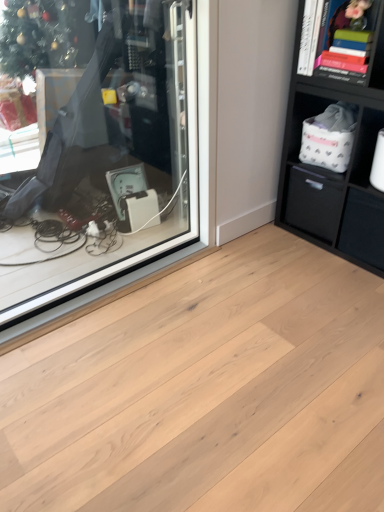
Measure the distance between hardcover book at upper right, placed as the second cabinet when sorted from right to left, and camera.

hardcover book at upper right, placed as the second cabinet when sorted from right to left, and camera are 1.70 meters apart.

What do you see at coordinates (313, 200) in the screenshot? Image resolution: width=384 pixels, height=512 pixels. I see `black fabric drawer at lower right, the 1th drawer when ordered from left to right` at bounding box center [313, 200].

This screenshot has height=512, width=384. What are the coordinates of `white fabric basket at right, which is the second cabinet from top to bottom` in the screenshot? It's located at (365, 147).

Measure the distance between point (364, 151) and camera.

Point (364, 151) and camera are 6.42 feet apart.

This screenshot has width=384, height=512. Describe the element at coordinates (207, 391) in the screenshot. I see `natural wood plank at center` at that location.

Locate an element on the screen. The image size is (384, 512). matte black drawer at lower right, the 2th drawer when ordered from left to right is located at coordinates (363, 228).

Where is `hardcover book at upper right, placed as the second cabinet when sorted from right to left`? hardcover book at upper right, placed as the second cabinet when sorted from right to left is located at coordinates (342, 42).

Which point is more forward, (373, 133) or (85, 392)?

The point (85, 392) is in front.

From the image's perspective, relative to natural wood plank at center, is white fabric basket at right, the second cabinet from the left, above or below?

From the image's perspective, white fabric basket at right, the second cabinet from the left, appears above natural wood plank at center.

Considering the relative positions of white fabric basket at right, which is counted as the first cabinet, starting from the right, and natural wood plank at center in the image provided, is white fabric basket at right, which is counted as the first cabinet, starting from the right, behind natural wood plank at center?

Yes, white fabric basket at right, which is counted as the first cabinet, starting from the right, is further from the viewer.

Is white fabric basket at right, which is the second cabinet from top to bottom, facing towards natural wood plank at center?

Yes.

Is point (337, 453) farther from camera compared to point (356, 220)?

No, (337, 453) is in front of (356, 220).

From the image's perspective, is natural wood plank at center positioned above or below matte black drawer at lower right, the 2th drawer when ordered from left to right?

Clearly, from the image's perspective, natural wood plank at center is below matte black drawer at lower right, the 2th drawer when ordered from left to right.

Considering the sizes of objects natural wood plank at center and matte black drawer at lower right, the 1th drawer from the right, in the image provided, who is wider, natural wood plank at center or matte black drawer at lower right, the 1th drawer from the right,?

Wider between the two is natural wood plank at center.

Locate an element on the screen. the 1st drawer above the natural wood plank at center (from the image's perspective) is located at coordinates (363, 228).

Could matte black drawer at lower right, the 1th drawer from the right, be considered to be inside black fabric drawer at lower right, which is counted as the second drawer, starting from the right?

Definitely not — matte black drawer at lower right, the 1th drawer from the right, is not inside black fabric drawer at lower right, which is counted as the second drawer, starting from the right.

In terms of size, does black fabric drawer at lower right, the 1th drawer when ordered from left to right, appear bigger or smaller than matte black drawer at lower right, the 2th drawer when ordered from left to right?

black fabric drawer at lower right, the 1th drawer when ordered from left to right, is bigger than matte black drawer at lower right, the 2th drawer when ordered from left to right.

From the image's perspective, is black fabric drawer at lower right, which is counted as the second drawer, starting from the right, located beneath matte black drawer at lower right, the 2th drawer when ordered from left to right?

No, from the image's perspective, black fabric drawer at lower right, which is counted as the second drawer, starting from the right, is not below matte black drawer at lower right, the 2th drawer when ordered from left to right.

From a real-world perspective, is black fabric drawer at lower right, which is counted as the second drawer, starting from the right, physically located above or below matte black drawer at lower right, the 2th drawer when ordered from left to right?

black fabric drawer at lower right, which is counted as the second drawer, starting from the right, is situated higher than matte black drawer at lower right, the 2th drawer when ordered from left to right, in the real world.

Are white fabric basket at right, the second cabinet from the left, and transparent glass shop window at upper left located far from each other?

white fabric basket at right, the second cabinet from the left, is positioned a significant distance from transparent glass shop window at upper left.

From a real-world perspective, is white fabric basket at right, which is the second cabinet from top to bottom, under transparent glass shop window at upper left?

Yes, from a real-world perspective, white fabric basket at right, which is the second cabinet from top to bottom, is beneath transparent glass shop window at upper left.

Which object is further away from the camera, white fabric basket at right, which is the second cabinet from top to bottom, or transparent glass shop window at upper left?

Positioned behind is white fabric basket at right, which is the second cabinet from top to bottom.

Looking at this image, is white fabric basket at right, which is counted as the first cabinet, starting from the right, bigger or smaller than transparent glass shop window at upper left?

Considering their sizes, white fabric basket at right, which is counted as the first cabinet, starting from the right, takes up less space than transparent glass shop window at upper left.

Can you confirm if black fabric drawer at lower right, the 1th drawer when ordered from left to right, is wider than transparent glass shop window at upper left?

Indeed, black fabric drawer at lower right, the 1th drawer when ordered from left to right, has a greater width compared to transparent glass shop window at upper left.

Do you think black fabric drawer at lower right, which is counted as the second drawer, starting from the right, is within transparent glass shop window at upper left, or outside of it?

black fabric drawer at lower right, which is counted as the second drawer, starting from the right, is outside transparent glass shop window at upper left.

Does black fabric drawer at lower right, the 1th drawer when ordered from left to right, turn towards transparent glass shop window at upper left?

Yes, black fabric drawer at lower right, the 1th drawer when ordered from left to right, is aimed at transparent glass shop window at upper left.

Who is bigger, white fabric basket at right, the second cabinet from the left, or black fabric drawer at lower right, the 1th drawer when ordered from left to right?

black fabric drawer at lower right, the 1th drawer when ordered from left to right, is bigger.

From the image's perspective, is white fabric basket at right, which appears as the 1th cabinet when ordered from the bottom, under black fabric drawer at lower right, the 1th drawer when ordered from left to right?

No, from the image's perspective, white fabric basket at right, which appears as the 1th cabinet when ordered from the bottom, is not beneath black fabric drawer at lower right, the 1th drawer when ordered from left to right.

Considering the positions of points (366, 159) and (329, 181), is point (366, 159) closer to camera compared to point (329, 181)?

Yes, it is in front of point (329, 181).

Considering the relative sizes of matte black drawer at lower right, the 2th drawer when ordered from left to right, and white fabric basket at right, which is the second cabinet from top to bottom, in the image provided, is matte black drawer at lower right, the 2th drawer when ordered from left to right, thinner than white fabric basket at right, which is the second cabinet from top to bottom,?

In fact, matte black drawer at lower right, the 2th drawer when ordered from left to right, might be wider than white fabric basket at right, which is the second cabinet from top to bottom.

Is matte black drawer at lower right, the 2th drawer when ordered from left to right, bigger or smaller than white fabric basket at right, which appears as the 1th cabinet when ordered from the bottom?

matte black drawer at lower right, the 2th drawer when ordered from left to right, is bigger than white fabric basket at right, which appears as the 1th cabinet when ordered from the bottom.

Is matte black drawer at lower right, the 2th drawer when ordered from left to right, not close to white fabric basket at right, which appears as the 1th cabinet when ordered from the bottom?

matte black drawer at lower right, the 2th drawer when ordered from left to right, is actually quite close to white fabric basket at right, which appears as the 1th cabinet when ordered from the bottom.

Does matte black drawer at lower right, the 2th drawer when ordered from left to right, appear on the left side of white fabric basket at right, the second cabinet from the left?

In fact, matte black drawer at lower right, the 2th drawer when ordered from left to right, is to the right of white fabric basket at right, the second cabinet from the left.

Find the location of `plank in front of the white fabric basket at right, the second cabinet from the left`. plank in front of the white fabric basket at right, the second cabinet from the left is located at coordinates (207, 391).

This screenshot has height=512, width=384. In order to click on drawer that is the 1st object above the natural wood plank at center (from a real-world perspective) in this screenshot , I will do `click(363, 228)`.

Considering their positions, is black fabric drawer at lower right, which is counted as the second drawer, starting from the right, positioned closer to matte black drawer at lower right, the 2th drawer when ordered from left to right, than white fabric basket at right, which is the second cabinet from top to bottom?

black fabric drawer at lower right, which is counted as the second drawer, starting from the right, is closer to matte black drawer at lower right, the 2th drawer when ordered from left to right.

When comparing their distances from black fabric drawer at lower right, which is counted as the second drawer, starting from the right, does natural wood plank at center or hardcover book at upper right, the 1th cabinet from the left, seem closer?

The object closer to black fabric drawer at lower right, which is counted as the second drawer, starting from the right, is hardcover book at upper right, the 1th cabinet from the left.

From the image, which object appears to be nearer to matte black drawer at lower right, the 1th drawer from the right, hardcover book at upper right, which appears as the first cabinet when viewed from the top, or natural wood plank at center?

Among the two, hardcover book at upper right, which appears as the first cabinet when viewed from the top, is located nearer to matte black drawer at lower right, the 1th drawer from the right.

From the image, which object appears to be nearer to black fabric drawer at lower right, which is counted as the second drawer, starting from the right, transparent glass shop window at upper left or white fabric basket at right, which is the second cabinet from top to bottom?

Among the two, white fabric basket at right, which is the second cabinet from top to bottom, is located nearer to black fabric drawer at lower right, which is counted as the second drawer, starting from the right.

Estimate the real-world distances between objects in this image. Which object is further from transparent glass shop window at upper left, matte black drawer at lower right, the 1th drawer from the right, or hardcover book at upper right, placed as the second cabinet when sorted from right to left?

matte black drawer at lower right, the 1th drawer from the right, is further to transparent glass shop window at upper left.

Looking at the image, which one is located further to transparent glass shop window at upper left, natural wood plank at center or white fabric basket at right, which appears as the 1th cabinet when ordered from the bottom?

white fabric basket at right, which appears as the 1th cabinet when ordered from the bottom, lies further to transparent glass shop window at upper left than the other object.

From the image, which object appears to be farther from black fabric drawer at lower right, which is counted as the second drawer, starting from the right, hardcover book at upper right, the 1th cabinet from the left, or white fabric basket at right, which is counted as the first cabinet, starting from the right?

hardcover book at upper right, the 1th cabinet from the left.

Estimate the real-world distances between objects in this image. Which object is further from white fabric basket at right, which is the second cabinet from top to bottom, natural wood plank at center or hardcover book at upper right, the 1th cabinet from the left?

natural wood plank at center lies further to white fabric basket at right, which is the second cabinet from top to bottom, than the other object.

This screenshot has height=512, width=384. Identify the location of drawer between transparent glass shop window at upper left and white fabric basket at right, which is counted as the first cabinet, starting from the right, from left to right. (313, 200).

Locate an element on the screen. plank located between transparent glass shop window at upper left and white fabric basket at right, which is counted as the first cabinet, starting from the right, in the left-right direction is located at coordinates (207, 391).

Locate an element on the screen. drawer between natural wood plank at center and black fabric drawer at lower right, which is counted as the second drawer, starting from the right, in the front-back direction is located at coordinates (363, 228).

I want to click on drawer located between white fabric basket at right, which is the second cabinet from top to bottom, and black fabric drawer at lower right, the 1th drawer when ordered from left to right, in the depth direction, so click(363, 228).